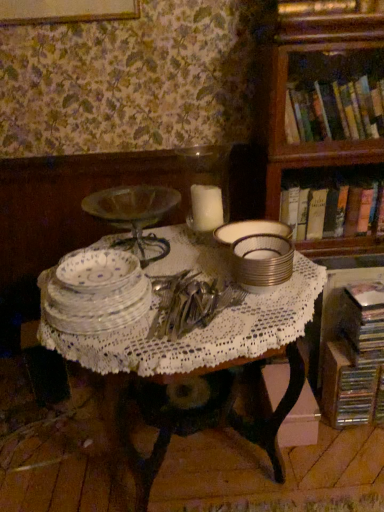
At what (x,y) coordinates should I click in order to perform the action: click on silver metallic stack at center, the second tableware viewed from the left. Please return your answer as a coordinate pair (x, y). Looking at the image, I should click on (262, 262).

Measure the distance between hardcover book at right, the 2th book positioned from the bottom, and camera.

hardcover book at right, the 2th book positioned from the bottom, and camera are 1.54 meters apart.

Describe the element at coordinates (331, 208) in the screenshot. I see `hardcover book at right, the 2th book positioned from the bottom` at that location.

In order to face white wax candle at center, should I rotate leftwards or rightwards?

To face it directly, rotate right by 2.213 degrees.

The height and width of the screenshot is (512, 384). In order to click on clear glass plates at center, positioned as the first tableware in left-to-right order in this screenshot , I will do tap(96, 292).

This screenshot has width=384, height=512. What are the coordinates of `hardcover books at upper right, the 3th book from the bottom` in the screenshot? It's located at (334, 110).

The height and width of the screenshot is (512, 384). Describe the element at coordinates (356, 359) in the screenshot. I see `metallic silver book at lower right, acting as the first book starting from the bottom` at that location.

In order to click on wooden bookcase at upper right in this screenshot , I will do `click(327, 114)`.

Which is more to the right, hardcover books at upper right, acting as the first book starting from the top, or porcelain plate at center?

hardcover books at upper right, acting as the first book starting from the top.

In the scene shown: Who is taller, hardcover books at upper right, the 3th book from the bottom, or porcelain plate at center?

Standing taller between the two is hardcover books at upper right, the 3th book from the bottom.

In terms of size, does hardcover books at upper right, the 3th book from the bottom, appear bigger or smaller than porcelain plate at center?

Clearly, hardcover books at upper right, the 3th book from the bottom, is larger in size than porcelain plate at center.

Is point (295, 134) behind point (91, 281)?

That is True.

Between hardcover book at right, the 2th book positioned from the bottom, and white wax candle at center, which one has larger size?

hardcover book at right, the 2th book positioned from the bottom, is bigger.

How distant is hardcover book at right, the 2th book positioned from the bottom, from white wax candle at center?

They are 17.27 inches apart.

Is white wax candle at center at the back of hardcover book at right, the 2th book positioned from the bottom?

No, white wax candle at center is not at the back of hardcover book at right, the 2th book positioned from the bottom.

Considering the relative sizes of hardcover book at right, the 2th book from the top, and white wax candle at center in the image provided, is hardcover book at right, the 2th book from the top, thinner than white wax candle at center?

In fact, hardcover book at right, the 2th book from the top, might be wider than white wax candle at center.

Is hardcover book at right, the 2th book from the top, to the right of white lace tablecloth at center from the viewer's perspective?

Yes, hardcover book at right, the 2th book from the top, is to the right of white lace tablecloth at center.

Is point (362, 188) in front of point (223, 272)?

No.

Based on the photo, from the image's perspective, who appears lower, hardcover book at right, the 2th book from the top, or white lace tablecloth at center?

white lace tablecloth at center is shown below in the image.

Based on the photo, could you tell me if hardcover book at right, the 2th book positioned from the bottom, is turned towards white lace tablecloth at center?

No, hardcover book at right, the 2th book positioned from the bottom, is not oriented towards white lace tablecloth at center.

Does hardcover books at upper right, the 3th book from the bottom, come in front of wooden bookcase at upper right?

No, hardcover books at upper right, the 3th book from the bottom, is behind wooden bookcase at upper right.

Would you say wooden bookcase at upper right is part of hardcover books at upper right, the 3th book from the bottom,'s contents?

Actually, wooden bookcase at upper right is outside hardcover books at upper right, the 3th book from the bottom.

In the scene shown: Is hardcover books at upper right, the 3th book from the bottom, shorter than wooden bookcase at upper right?

Yes, hardcover books at upper right, the 3th book from the bottom, is shorter than wooden bookcase at upper right.

Can you see white wax candle at center touching clear glass plates at center, positioned as the first tableware in left-to-right order?

There is a gap between white wax candle at center and clear glass plates at center, positioned as the first tableware in left-to-right order.

Image resolution: width=384 pixels, height=512 pixels. In order to click on candle behind the clear glass plates at center, positioned as the first tableware in left-to-right order in this screenshot , I will do `click(206, 208)`.

Does point (200, 200) come farther from viewer compared to point (132, 257)?

That is True.

Is white wax candle at center next to hardcover book at right, the 2th book from the top?

No, white wax candle at center is not beside hardcover book at right, the 2th book from the top.

Can you confirm if white wax candle at center is positioned to the left of hardcover book at right, the 2th book from the top?

Yes.

Does point (202, 193) lie behind point (311, 198)?

No, it is in front of (311, 198).

This screenshot has height=512, width=384. I want to click on the 2nd tableware counting from the left of the hardcover book at right, the 2th book positioned from the bottom, so click(96, 292).

Is hardcover book at right, the 2th book from the top, surrounding clear glass plates at center, placed as the second tableware when sorted from right to left?

No, clear glass plates at center, placed as the second tableware when sorted from right to left, is not inside hardcover book at right, the 2th book from the top.

Considering the sizes of hardcover book at right, the 2th book positioned from the bottom, and clear glass plates at center, placed as the second tableware when sorted from right to left, in the image, is hardcover book at right, the 2th book positioned from the bottom, bigger or smaller than clear glass plates at center, placed as the second tableware when sorted from right to left,?

Clearly, hardcover book at right, the 2th book positioned from the bottom, is larger in size than clear glass plates at center, placed as the second tableware when sorted from right to left.

Which object is positioned more to the right, hardcover book at right, the 2th book positioned from the bottom, or clear glass plates at center, positioned as the first tableware in left-to-right order?

Positioned to the right is hardcover book at right, the 2th book positioned from the bottom.

This screenshot has height=512, width=384. I want to click on platter below the hardcover books at upper right, the 3th book from the bottom (from a real-world perspective), so click(98, 271).

At what (x,y) coordinates should I click in order to perform the action: click on book that is the 3rd one when counting backward from the white wax candle at center. Please return your answer as a coordinate pair (x, y). Looking at the image, I should click on (331, 208).

When comparing their distances from clear glass plates at center, positioned as the first tableware in left-to-right order, does porcelain plate at center or metallic silver book at lower right, acting as the first book starting from the bottom, seem further?

metallic silver book at lower right, acting as the first book starting from the bottom, is further to clear glass plates at center, positioned as the first tableware in left-to-right order.

Which object lies nearer to the anchor point clear glass plates at center, positioned as the first tableware in left-to-right order, wooden bookcase at upper right or silver metallic stack at center, the second tableware viewed from the left?

silver metallic stack at center, the second tableware viewed from the left, is closer to clear glass plates at center, positioned as the first tableware in left-to-right order.

Estimate the real-world distances between objects in this image. Which object is closer to hardcover books at upper right, acting as the first book starting from the top, white lace tablecloth at center or white wax candle at center?

white wax candle at center is closer to hardcover books at upper right, acting as the first book starting from the top.

When comparing their distances from silver metallic stack at center, the second tableware viewed from the left, does clear glass plates at center, placed as the second tableware when sorted from right to left, or wooden bookcase at upper right seem closer?

clear glass plates at center, placed as the second tableware when sorted from right to left, is closer to silver metallic stack at center, the second tableware viewed from the left.

Looking at the image, which one is located further to hardcover books at upper right, acting as the first book starting from the top, wooden bookcase at upper right or silver metallic stack at center, positioned as the 1th tableware in right-to-left order?

The object further to hardcover books at upper right, acting as the first book starting from the top, is silver metallic stack at center, positioned as the 1th tableware in right-to-left order.

Looking at the image, which one is located closer to white wax candle at center, metallic silver book at lower right, acting as the first book starting from the bottom, or wooden bookcase at upper right?

Among the two, wooden bookcase at upper right is located nearer to white wax candle at center.

Based on their spatial positions, is clear glass plates at center, positioned as the first tableware in left-to-right order, or silver metallic stack at center, positioned as the 1th tableware in right-to-left order, closer to wooden bookcase at upper right?

→ silver metallic stack at center, positioned as the 1th tableware in right-to-left order, is closer to wooden bookcase at upper right.

Which object lies further to the anchor point white lace tablecloth at center, silver metallic stack at center, positioned as the 1th tableware in right-to-left order, or porcelain plate at center?

porcelain plate at center lies further to white lace tablecloth at center than the other object.

This screenshot has height=512, width=384. What are the coordinates of `table between porcelain plate at center and silver metallic stack at center, positioned as the 1th tableware in right-to-left order, from left to right` in the screenshot? It's located at (204, 333).

You are a GUI agent. You are given a task and a screenshot of the screen. Output one action in this format:
    pyautogui.click(x=<x>, y=<y>)
    Task: Click on the candle situated between clear glass plates at center, positioned as the first tableware in left-to-right order, and silver metallic stack at center, the second tableware viewed from the left, from left to right
    
    Given the screenshot: What is the action you would take?
    pyautogui.click(x=206, y=208)

Where is `bookcase between hardcover books at upper right, the 3th book from the bottom, and hardcover book at right, the 2th book positioned from the bottom, vertically`? The image size is (384, 512). bookcase between hardcover books at upper right, the 3th book from the bottom, and hardcover book at right, the 2th book positioned from the bottom, vertically is located at coordinates (327, 114).

In order to click on table between porcelain plate at center and wooden bookcase at upper right in this screenshot , I will do `click(204, 333)`.